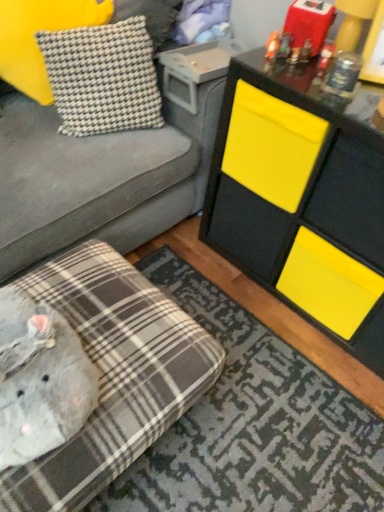
Describe the element at coordinates (98, 178) in the screenshot. The height and width of the screenshot is (512, 384). I see `gray corduroy studio couch at upper left, the 1th studio couch viewed from the top` at that location.

What do you see at coordinates (103, 77) in the screenshot?
I see `houndstooth fabric pillow at upper left, acting as the second pillow starting from the left` at bounding box center [103, 77].

The width and height of the screenshot is (384, 512). Identify the location of matte plastic toy at upper right, positioned as the 1th toy in right-to-left order. (284, 47).

Identify the location of houndstooth fabric pillow at upper left, marked as the 2th pillow in a right-to-left arrangement. (35, 40).

Measure the distance between matte orange figurine at upper right, which appears as the 2th toy when viewed from the right, and camera.

The distance of matte orange figurine at upper right, which appears as the 2th toy when viewed from the right, from camera is 4.23 feet.

Locate an element on the screen. Image resolution: width=384 pixels, height=512 pixels. plaid fabric ottoman at lower left, which is counted as the second studio couch, starting from the top is located at coordinates (113, 374).

This screenshot has height=512, width=384. What are the coordinates of `plaid fabric mat at lower left` in the screenshot? It's located at (253, 425).

I want to click on gray corduroy studio couch at upper left, which is the 2th studio couch from bottom to top, so click(98, 178).

Is matte orange figurine at upper right, which is counted as the first toy, starting from the left, outside of houndstooth fabric pillow at upper left, placed as the 1th pillow when sorted from right to left?

Yes, matte orange figurine at upper right, which is counted as the first toy, starting from the left, is not within houndstooth fabric pillow at upper left, placed as the 1th pillow when sorted from right to left.

Is matte orange figurine at upper right, which appears as the 2th toy when viewed from the right, not close to houndstooth fabric pillow at upper left, acting as the second pillow starting from the left?

Actually, matte orange figurine at upper right, which appears as the 2th toy when viewed from the right, and houndstooth fabric pillow at upper left, acting as the second pillow starting from the left, are a little close together.

Is gray corduroy studio couch at upper left, which is the 2th studio couch from bottom to top, turned away from matte plastic toy at upper right, positioned as the 1th toy in right-to-left order?

No, gray corduroy studio couch at upper left, which is the 2th studio couch from bottom to top,'s orientation is not away from matte plastic toy at upper right, positioned as the 1th toy in right-to-left order.

From their relative heights in the image, would you say gray corduroy studio couch at upper left, the 1th studio couch viewed from the top, is taller or shorter than matte plastic toy at upper right, acting as the 2th toy starting from the left?

In the image, gray corduroy studio couch at upper left, the 1th studio couch viewed from the top, appears to be taller than matte plastic toy at upper right, acting as the 2th toy starting from the left.

Is gray corduroy studio couch at upper left, the 1th studio couch viewed from the top, wider than matte plastic toy at upper right, acting as the 2th toy starting from the left?

Correct, the width of gray corduroy studio couch at upper left, the 1th studio couch viewed from the top, exceeds that of matte plastic toy at upper right, acting as the 2th toy starting from the left.

Would you say gray corduroy studio couch at upper left, the 1th studio couch viewed from the top, is outside matte plastic toy at upper right, acting as the 2th toy starting from the left?

gray corduroy studio couch at upper left, the 1th studio couch viewed from the top, lies outside matte plastic toy at upper right, acting as the 2th toy starting from the left,'s area.

From the image's perspective, who appears lower, gray corduroy studio couch at upper left, the 1th studio couch viewed from the top, or matte orange figurine at upper right, which is counted as the first toy, starting from the left?

gray corduroy studio couch at upper left, the 1th studio couch viewed from the top, is shown below in the image.

Is gray corduroy studio couch at upper left, which is the 2th studio couch from bottom to top, turned away from matte orange figurine at upper right, which is counted as the first toy, starting from the left?

gray corduroy studio couch at upper left, which is the 2th studio couch from bottom to top, is not turned away from matte orange figurine at upper right, which is counted as the first toy, starting from the left.

From a real-world perspective, does gray corduroy studio couch at upper left, the 1th studio couch viewed from the top, stand above matte orange figurine at upper right, which appears as the 2th toy when viewed from the right?

No, from a real-world perspective, gray corduroy studio couch at upper left, the 1th studio couch viewed from the top, is not on top of matte orange figurine at upper right, which appears as the 2th toy when viewed from the right.

Which is in front, point (4, 208) or point (272, 36)?

The point (4, 208) is closer.

How many degrees apart are the facing directions of houndstooth fabric pillow at upper left, placed as the 1th pillow when sorted from right to left, and matte orange figurine at upper right, which appears as the 2th toy when viewed from the right?

The facing directions of houndstooth fabric pillow at upper left, placed as the 1th pillow when sorted from right to left, and matte orange figurine at upper right, which appears as the 2th toy when viewed from the right, are 19.5 degrees apart.

From the image's perspective, is houndstooth fabric pillow at upper left, placed as the 1th pillow when sorted from right to left, located above matte orange figurine at upper right, which is counted as the first toy, starting from the left?

No, from the image's perspective, houndstooth fabric pillow at upper left, placed as the 1th pillow when sorted from right to left, is not over matte orange figurine at upper right, which is counted as the first toy, starting from the left.

From a real-world perspective, count 2nd pillows downward from the matte orange figurine at upper right, which appears as the 2th toy when viewed from the right, and point to it. Please provide its 2D coordinates.

[(103, 77)]

Which is farther, [58,91] or [270,44]?

The point [58,91] is farther from the camera.

From the image's perspective, does plaid fabric ottoman at lower left, the 1th studio couch positioned from the bottom, appear higher than plaid fabric mat at lower left?

Yes, from the image's perspective, plaid fabric ottoman at lower left, the 1th studio couch positioned from the bottom, is over plaid fabric mat at lower left.

Is point (128, 407) farther from viewer compared to point (363, 409)?

No, it is in front of (363, 409).

Is there a large distance between plaid fabric ottoman at lower left, the 1th studio couch positioned from the bottom, and plaid fabric mat at lower left?

No.

Which object is positioned more to the right, plaid fabric ottoman at lower left, which is counted as the second studio couch, starting from the top, or plaid fabric mat at lower left?

Positioned to the right is plaid fabric mat at lower left.

From a real-world perspective, is houndstooth fabric pillow at upper left, placed as the 1th pillow when sorted from right to left, on yellow matte cabinet at upper right?

Yes, from a real-world perspective, houndstooth fabric pillow at upper left, placed as the 1th pillow when sorted from right to left, is on top of yellow matte cabinet at upper right.

From the picture: Could you measure the distance between houndstooth fabric pillow at upper left, placed as the 1th pillow when sorted from right to left, and yellow matte cabinet at upper right?

houndstooth fabric pillow at upper left, placed as the 1th pillow when sorted from right to left, and yellow matte cabinet at upper right are 21.32 inches apart from each other.

Which point is more distant from viewer, [112,45] or [374,154]?

The point [112,45] is farther.

Is houndstooth fabric pillow at upper left, acting as the second pillow starting from the left, oriented away from yellow matte cabinet at upper right?

No.

Is yellow matte cabinet at upper right bigger or smaller than plaid fabric ottoman at lower left, the 1th studio couch positioned from the bottom?

Result: In the image, yellow matte cabinet at upper right appears to be larger than plaid fabric ottoman at lower left, the 1th studio couch positioned from the bottom.

Can you tell me how much yellow matte cabinet at upper right and plaid fabric ottoman at lower left, the 1th studio couch positioned from the bottom, differ in facing direction?

The facing directions of yellow matte cabinet at upper right and plaid fabric ottoman at lower left, the 1th studio couch positioned from the bottom, are 88.4 degrees apart.

Looking at this image, from the image's perspective, which one is positioned lower, yellow matte cabinet at upper right or plaid fabric ottoman at lower left, the 1th studio couch positioned from the bottom?

plaid fabric ottoman at lower left, the 1th studio couch positioned from the bottom.

Is yellow matte cabinet at upper right oriented towards plaid fabric ottoman at lower left, which is counted as the second studio couch, starting from the top?

Yes, yellow matte cabinet at upper right is facing plaid fabric ottoman at lower left, which is counted as the second studio couch, starting from the top.

This screenshot has width=384, height=512. In order to click on toy that is the 2nd one when counting upward from the houndstooth fabric pillow at upper left, placed as the 1th pillow when sorted from right to left (from the image's perspective) in this screenshot , I will do `click(272, 45)`.

At what (x,y) coordinates should I click in order to perform the action: click on the 2nd toy positioned above the gray corduroy studio couch at upper left, the 1th studio couch viewed from the top (from a real-world perspective). Please return your answer as a coordinate pair (x, y). Looking at the image, I should click on (284, 47).

Estimate the real-world distances between objects in this image. Which object is closer to matte orange figurine at upper right, which appears as the 2th toy when viewed from the right, plaid fabric ottoman at lower left, the 1th studio couch positioned from the bottom, or houndstooth fabric pillow at upper left, acting as the second pillow starting from the left?

Among the two, houndstooth fabric pillow at upper left, acting as the second pillow starting from the left, is located nearer to matte orange figurine at upper right, which appears as the 2th toy when viewed from the right.

Considering their positions, is matte orange figurine at upper right, which is counted as the first toy, starting from the left, positioned further to houndstooth fabric pillow at upper left, arranged as the first pillow when viewed from the left, than matte plastic toy at upper right, acting as the 2th toy starting from the left?

matte plastic toy at upper right, acting as the 2th toy starting from the left, is further to houndstooth fabric pillow at upper left, arranged as the first pillow when viewed from the left.

Based on their spatial positions, is gray corduroy studio couch at upper left, which is the 2th studio couch from bottom to top, or plaid fabric mat at lower left closer to plaid fabric ottoman at lower left, which is counted as the second studio couch, starting from the top?

plaid fabric mat at lower left is closer to plaid fabric ottoman at lower left, which is counted as the second studio couch, starting from the top.

From the image, which object appears to be nearer to plaid fabric ottoman at lower left, the 1th studio couch positioned from the bottom, matte plastic toy at upper right, acting as the 2th toy starting from the left, or gray corduroy studio couch at upper left, the 1th studio couch viewed from the top?

gray corduroy studio couch at upper left, the 1th studio couch viewed from the top.

Based on their spatial positions, is gray corduroy studio couch at upper left, the 1th studio couch viewed from the top, or houndstooth fabric pillow at upper left, arranged as the first pillow when viewed from the left, closer to plaid fabric mat at lower left?

gray corduroy studio couch at upper left, the 1th studio couch viewed from the top, lies closer to plaid fabric mat at lower left than the other object.

From the image, which object appears to be nearer to yellow matte cabinet at upper right, plaid fabric mat at lower left or gray corduroy studio couch at upper left, which is the 2th studio couch from bottom to top?

Among the two, gray corduroy studio couch at upper left, which is the 2th studio couch from bottom to top, is located nearer to yellow matte cabinet at upper right.

From the image, which object appears to be farther from gray corduroy studio couch at upper left, which is the 2th studio couch from bottom to top, houndstooth fabric pillow at upper left, marked as the 2th pillow in a right-to-left arrangement, or plaid fabric mat at lower left?

plaid fabric mat at lower left lies further to gray corduroy studio couch at upper left, which is the 2th studio couch from bottom to top, than the other object.

Which object lies nearer to the anchor point gray corduroy studio couch at upper left, the 1th studio couch viewed from the top, plaid fabric ottoman at lower left, which is counted as the second studio couch, starting from the top, or matte orange figurine at upper right, which is counted as the first toy, starting from the left?

plaid fabric ottoman at lower left, which is counted as the second studio couch, starting from the top, is positioned closer to the anchor gray corduroy studio couch at upper left, the 1th studio couch viewed from the top.

This screenshot has height=512, width=384. Find the location of `pillow between houndstooth fabric pillow at upper left, marked as the 2th pillow in a right-to-left arrangement, and plaid fabric ottoman at lower left, which is counted as the second studio couch, starting from the top, from top to bottom`. pillow between houndstooth fabric pillow at upper left, marked as the 2th pillow in a right-to-left arrangement, and plaid fabric ottoman at lower left, which is counted as the second studio couch, starting from the top, from top to bottom is located at coordinates (103, 77).

Locate an element on the screen. Image resolution: width=384 pixels, height=512 pixels. toy between matte orange figurine at upper right, which is counted as the first toy, starting from the left, and plaid fabric mat at lower left vertically is located at coordinates (284, 47).

You are a GUI agent. You are given a task and a screenshot of the screen. Output one action in this format:
    pyautogui.click(x=<x>, y=<y>)
    Task: Click on the toy between matte orange figurine at upper right, which is counted as the first toy, starting from the left, and plaid fabric ottoman at lower left, the 1th studio couch positioned from the bottom, in the vertical direction
    
    Given the screenshot: What is the action you would take?
    pyautogui.click(x=284, y=47)

Locate an element on the screen. The width and height of the screenshot is (384, 512). cabinetry between houndstooth fabric pillow at upper left, acting as the second pillow starting from the left, and plaid fabric mat at lower left in the up-down direction is located at coordinates coord(303,197).